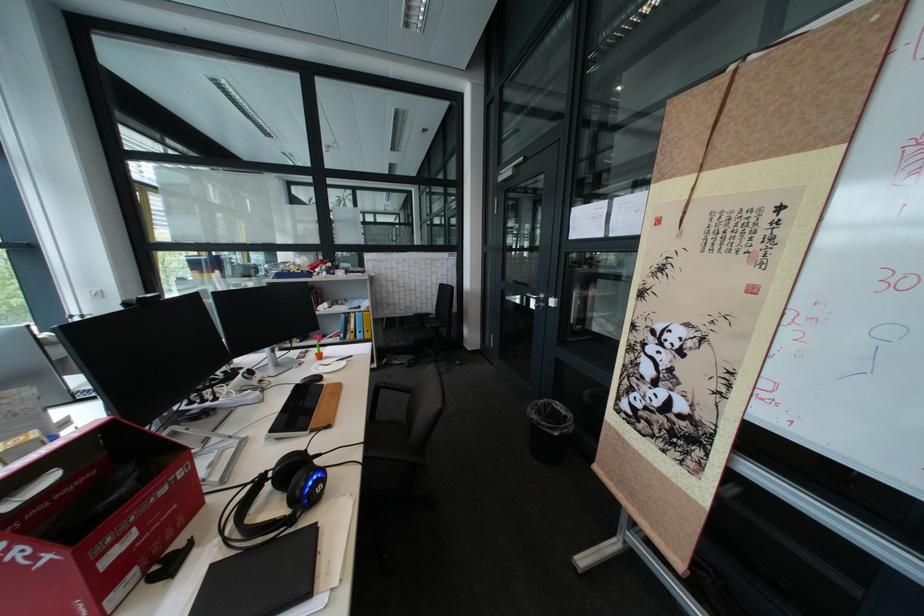
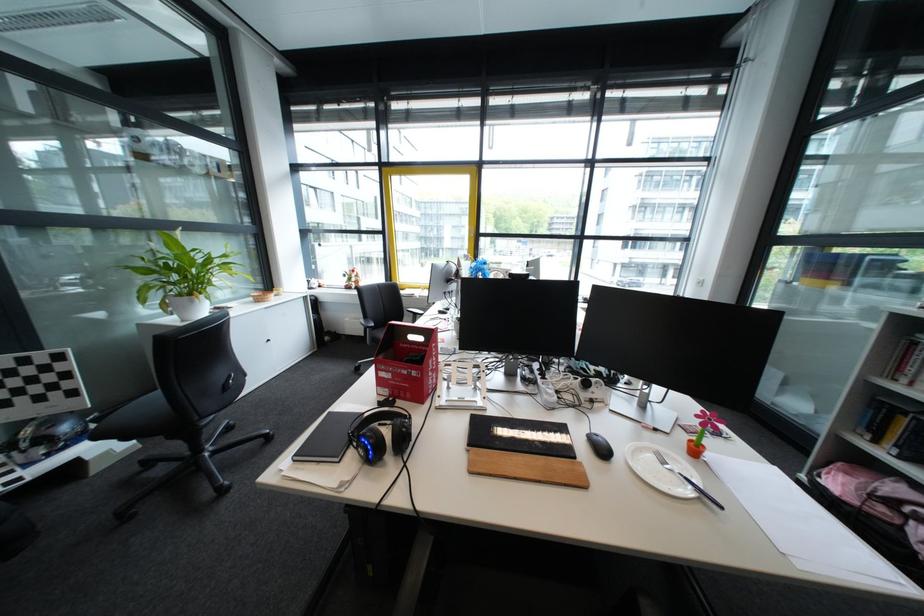
Locate, in the second image, the point that corresponds to [360,362] in the first image.

(712, 501)